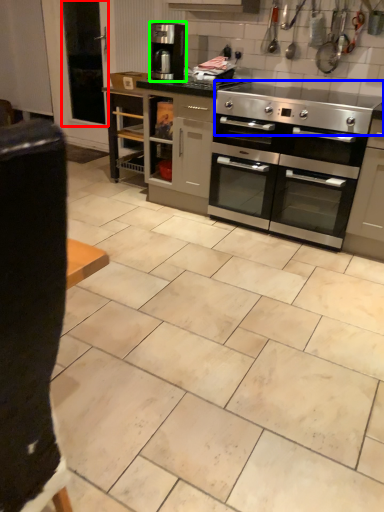
Question: Which object is positioned farthest from screen door (highlighted by a red box)? Select from gas stove (highlighted by a blue box) and coffee maker (highlighted by a green box).

Choices:
 (A) gas stove
 (B) coffee maker

Answer: (A)